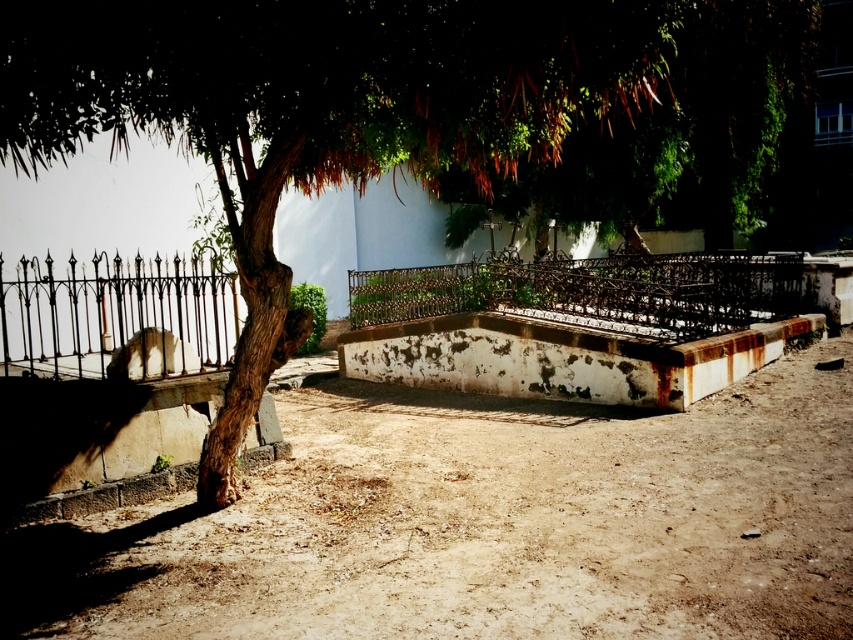
Is green leafy tree at center wider than black wrought iron fence at left?

Incorrect, green leafy tree at center's width does not surpass black wrought iron fence at left's.

Between point (44, 92) and point (22, 264), which one is positioned in front?

Point (44, 92) is in front.

Is point (222, 122) positioned after point (27, 272)?

No, it is not.

Find the location of a particular element. green leafy tree at center is located at coordinates (322, 109).

How distant is brown dusty ground at center from black wrought iron fence at left?

brown dusty ground at center and black wrought iron fence at left are 1.88 meters apart.

Is brown dusty ground at center closer to camera compared to black wrought iron fence at left?

That is True.

This screenshot has height=640, width=853. Describe the element at coordinates (485, 524) in the screenshot. I see `brown dusty ground at center` at that location.

Where is `brown dusty ground at center`? This screenshot has width=853, height=640. brown dusty ground at center is located at coordinates (485, 524).

Between brown dusty ground at center and green leafy tree at center, which one appears on the right side from the viewer's perspective?

green leafy tree at center

Describe the element at coordinates (485, 524) in the screenshot. I see `brown dusty ground at center` at that location.

Measure the distance between point (807,477) and camera.

Point (807,477) and camera are 20.42 feet apart from each other.

Where is `brown dusty ground at center`? The width and height of the screenshot is (853, 640). brown dusty ground at center is located at coordinates (485, 524).